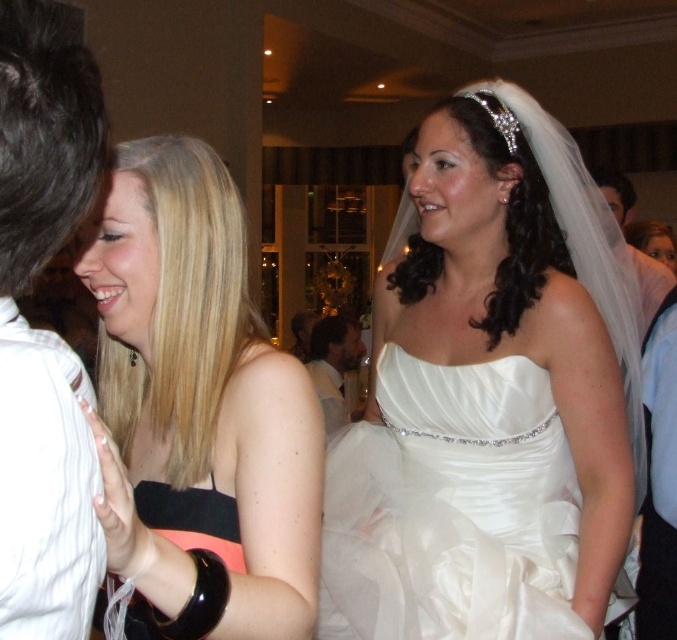
Who is positioned more to the right, white satin dress at center or black satin dress at left?

white satin dress at center

What do you see at coordinates (489, 396) in the screenshot? I see `white satin dress at center` at bounding box center [489, 396].

Is point (588, 576) closer to camera compared to point (206, 154)?

No, it is behind (206, 154).

Find the location of a particular element. white satin dress at center is located at coordinates (489, 396).

Does point (519, 368) come closer to viewer compared to point (30, 8)?

That is False.

Is white satin dress at center closer to camera compared to white striped shirt at left?

No.

Is point (468, 600) closer to camera compared to point (77, 384)?

No, it is not.

This screenshot has height=640, width=677. Find the location of `white satin dress at center`. white satin dress at center is located at coordinates (489, 396).

Find the location of a particular element. Image resolution: width=677 pixels, height=640 pixels. white striped shirt at left is located at coordinates (43, 330).

Can you confirm if white striped shirt at left is thinner than white satin suit at upper right?

Yes.

Consider the image. Who is more forward, (x=47, y=44) or (x=640, y=278)?

Point (x=47, y=44) is more forward.

This screenshot has height=640, width=677. I want to click on white striped shirt at left, so click(x=43, y=330).